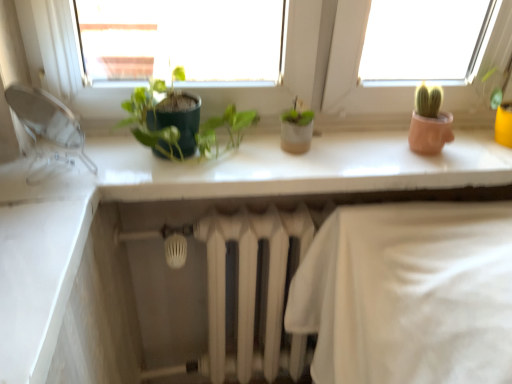
Question: Does white glossy counter top at upper center have a lesser height compared to transparent plastic faucet at left?

Choices:
 (A) no
 (B) yes

Answer: (B)

Question: Is white glossy counter top at upper center positioned far away from transparent plastic faucet at left?

Choices:
 (A) no
 (B) yes

Answer: (A)

Question: From a real-world perspective, does white glossy counter top at upper center sit lower than transparent plastic faucet at left?

Choices:
 (A) no
 (B) yes

Answer: (B)

Question: Could you tell me if white glossy counter top at upper center is turned towards transparent plastic faucet at left?

Choices:
 (A) yes
 (B) no

Answer: (B)

Question: Does white glossy counter top at upper center have a greater height compared to transparent plastic faucet at left?

Choices:
 (A) yes
 (B) no

Answer: (B)

Question: Considering the relative positions of white glossy counter top at upper center and green matte plant at center in the image provided, is white glossy counter top at upper center to the left or to the right of green matte plant at center?

Choices:
 (A) right
 (B) left

Answer: (A)

Question: In terms of size, does white glossy counter top at upper center appear bigger or smaller than green matte plant at center?

Choices:
 (A) big
 (B) small

Answer: (A)

Question: Is white glossy counter top at upper center inside or outside of green matte plant at center?

Choices:
 (A) outside
 (B) inside

Answer: (A)

Question: From the image's perspective, is white glossy counter top at upper center located above or below green matte plant at center?

Choices:
 (A) below
 (B) above

Answer: (A)

Question: Is green matte plant at center to the left or to the right of white glossy counter top at upper center in the image?

Choices:
 (A) right
 (B) left

Answer: (B)

Question: From the image's perspective, is green matte plant at center positioned above or below white glossy counter top at upper center?

Choices:
 (A) below
 (B) above

Answer: (B)

Question: In terms of height, does green matte plant at center look taller or shorter compared to white glossy counter top at upper center?

Choices:
 (A) short
 (B) tall

Answer: (B)

Question: From a real-world perspective, relative to white glossy counter top at upper center, is green matte plant at center vertically above or below?

Choices:
 (A) below
 (B) above

Answer: (B)

Question: Does point (56, 137) appear closer or farther from the camera than point (415, 170)?

Choices:
 (A) closer
 (B) farther

Answer: (B)

Question: From a real-world perspective, relative to white glossy counter top at upper center, is transparent plastic faucet at left vertically above or below?

Choices:
 (A) below
 (B) above

Answer: (B)